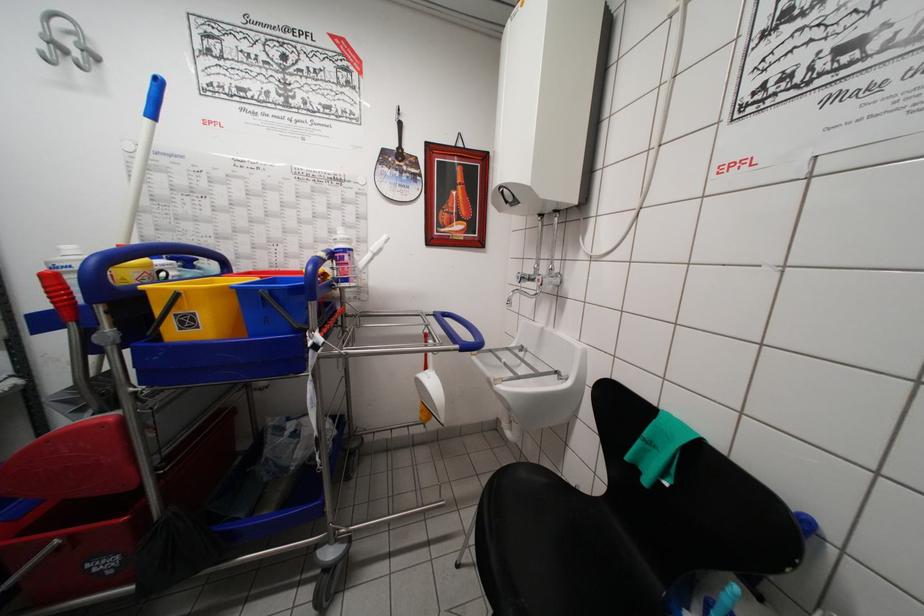
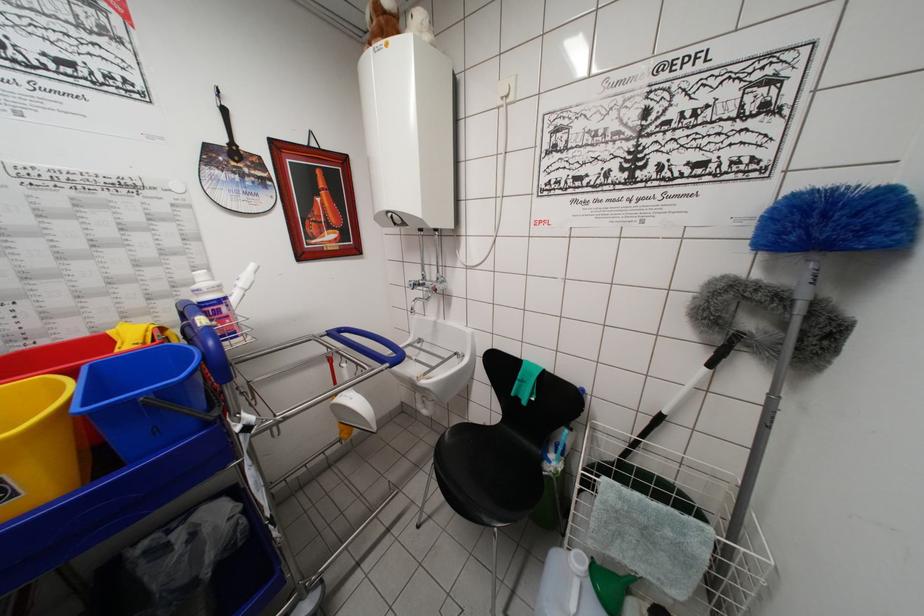
Locate, in the second image, the point that corresponds to the point at 497,384 in the first image.

(420, 383)